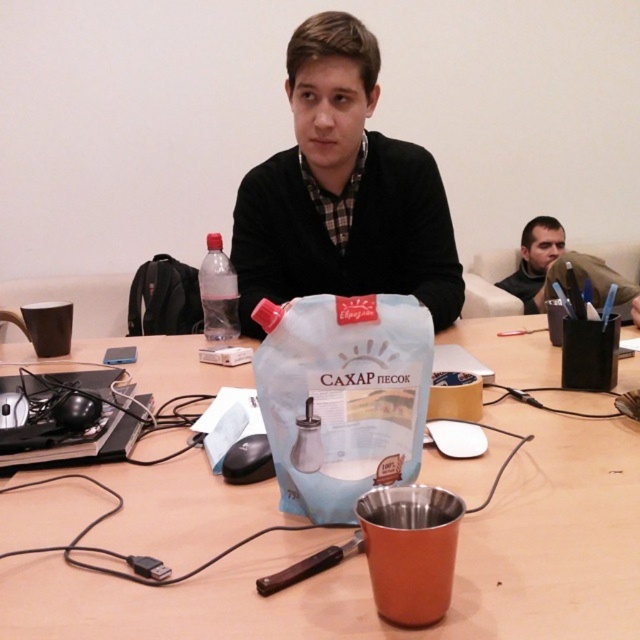
You are organizing a small event and need to place a decorative centerpiece between the black matte sweater at center and the camera. Given that the centerpiece requires 1.5 meters of space, will there be enough room between them?

The black matte sweater at center and the camera are 1.33 meters apart from each other. Since the required space for the centerpiece is 1.5 meters, there isn not enough room between them.

You are organizing items on a table. You need to place a new item between the transparent plastic bottle at center and the matte black jacket at upper right. Where should you place it?

The transparent plastic bottle at center is located below the matte black jacket at upper right, so placing the new item between them would require positioning it either above the transparent plastic bottle at center or below the matte black jacket at upper right.

You are organizing items on a table and need to place the transparent plastic bottle at center and the matte black jacket at upper right. Which item requires more space due to its larger size?

The matte black jacket at upper right requires more space because it is larger than the transparent plastic bottle at center.